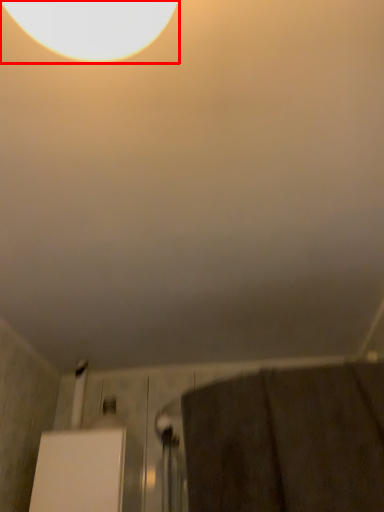
Question: From the image's perspective, where is lamp (annotated by the red box) located in relation to bath towel in the image?

Choices:
 (A) above
 (B) below

Answer: (A)